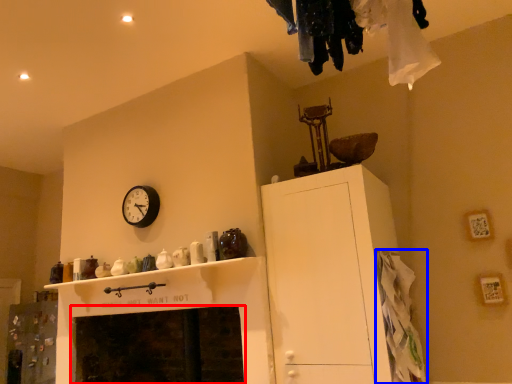
Question: Which object is closer to the camera taking this photo, fireplace (highlighted by a red box) or clothing (highlighted by a blue box)?

Choices:
 (A) fireplace
 (B) clothing

Answer: (B)